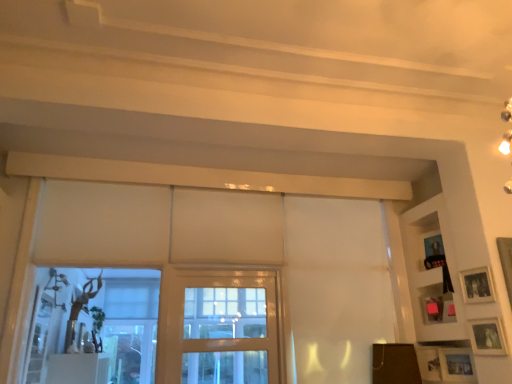
Image resolution: width=512 pixels, height=384 pixels. What do you see at coordinates (477, 285) in the screenshot? I see `matte black picture frame at upper right, acting as the fourth picture frame starting from the bottom` at bounding box center [477, 285].

What do you see at coordinates (431, 271) in the screenshot?
I see `wooden shelf at upper right` at bounding box center [431, 271].

What is the approximate width of matte silver picture frame at lower right, the 4th picture frame positioned from the top?

matte silver picture frame at lower right, the 4th picture frame positioned from the top, is 2.51 inches wide.

Measure the distance between point (488, 319) and camera.

A distance of 2.63 meters exists between point (488, 319) and camera.

What is the approximate width of matte white picture frame at lower right, the 2th picture frame positioned from the bottom?

1.22 inches.

What do you see at coordinates (336, 288) in the screenshot?
I see `white matte curtain at center` at bounding box center [336, 288].

In order to face brown matte board at lower right, should I rotate leftwards or rightwards?

Rotate your view right by about 18.520°.

Identify the location of matte black picture frame at upper right, acting as the first picture frame starting from the top. (477, 285).

Considering the relative sizes of pink matte picture frame at right, acting as the third picture frame starting from the bottom, and matte black picture frame at upper right, acting as the fourth picture frame starting from the bottom, in the image provided, is pink matte picture frame at right, acting as the third picture frame starting from the bottom, bigger than matte black picture frame at upper right, acting as the fourth picture frame starting from the bottom,?

Yes.

Is pink matte picture frame at right, acting as the third picture frame starting from the bottom, behind matte black picture frame at upper right, acting as the fourth picture frame starting from the bottom?

Yes, pink matte picture frame at right, acting as the third picture frame starting from the bottom, is further from the viewer.

Looking at their sizes, would you say pink matte picture frame at right, the 2th picture frame positioned from the top, is wider or thinner than matte black picture frame at upper right, acting as the first picture frame starting from the top?

pink matte picture frame at right, the 2th picture frame positioned from the top, is wider than matte black picture frame at upper right, acting as the first picture frame starting from the top.

Which point is more forward, (439,296) or (460,281)?

Point (460,281)

Could you tell me if white matte curtain at center is facing pink matte picture frame at right, acting as the third picture frame starting from the bottom?

Yes, white matte curtain at center is facing pink matte picture frame at right, acting as the third picture frame starting from the bottom.

Is white matte curtain at center wider than pink matte picture frame at right, the 2th picture frame positioned from the top?

Yes, white matte curtain at center is wider than pink matte picture frame at right, the 2th picture frame positioned from the top.

How different are the orientations of white matte curtain at center and pink matte picture frame at right, the 2th picture frame positioned from the top, in degrees?

61.5 degrees.

Between white matte curtain at center and pink matte picture frame at right, acting as the third picture frame starting from the bottom, which one is positioned behind?

pink matte picture frame at right, acting as the third picture frame starting from the bottom.

Do you think matte silver picture frame at lower right, the 1th picture frame in the bottom-to-top sequence, is within wooden shelf at upper right, or outside of it?

matte silver picture frame at lower right, the 1th picture frame in the bottom-to-top sequence, is not inside wooden shelf at upper right, it's outside.

Which object is further away from the camera taking this photo, matte silver picture frame at lower right, the 4th picture frame positioned from the top, or wooden shelf at upper right?

matte silver picture frame at lower right, the 4th picture frame positioned from the top.

Is matte silver picture frame at lower right, the 4th picture frame positioned from the top, smaller than wooden shelf at upper right?

Yes, matte silver picture frame at lower right, the 4th picture frame positioned from the top, is smaller than wooden shelf at upper right.

Image resolution: width=512 pixels, height=384 pixels. Identify the location of picture frame that is the 3rd object to the right of the wooden shelf at upper right, starting at the anchor. (456, 365).

Is brown matte board at lower right facing towards wooden shelf at upper right?

No, brown matte board at lower right does not turn towards wooden shelf at upper right.

Considering the relative positions of brown matte board at lower right and wooden shelf at upper right in the image provided, is brown matte board at lower right to the right of wooden shelf at upper right from the viewer's perspective?

Incorrect, brown matte board at lower right is not on the right side of wooden shelf at upper right.

Is point (414, 377) closer or farther from the camera than point (421, 251)?

Clearly, point (414, 377) is closer to the camera than point (421, 251).

Is brown matte board at lower right bigger or smaller than wooden shelf at upper right?

Clearly, brown matte board at lower right is smaller in size than wooden shelf at upper right.

Is clear glass screen door at center to the left of matte silver picture frame at lower right, the 4th picture frame positioned from the top, from the viewer's perspective?

Yes, clear glass screen door at center is to the left of matte silver picture frame at lower right, the 4th picture frame positioned from the top.

Is matte silver picture frame at lower right, the 1th picture frame in the bottom-to-top sequence, at the back of clear glass screen door at center?

No, clear glass screen door at center is not facing the opposite direction of matte silver picture frame at lower right, the 1th picture frame in the bottom-to-top sequence.

From the image's perspective, which one is positioned higher, clear glass screen door at center or matte silver picture frame at lower right, the 1th picture frame in the bottom-to-top sequence?

clear glass screen door at center is shown above in the image.

Can you tell me how much clear glass screen door at center and matte silver picture frame at lower right, the 1th picture frame in the bottom-to-top sequence, differ in facing direction?

They differ by 69 degrees in their facing directions.

Consider the image. What's the angular difference between brown matte board at lower right and pink matte picture frame at right, the 2th picture frame positioned from the top,'s facing directions?

They differ by 64 degrees in their facing directions.

Considering the sizes of brown matte board at lower right and pink matte picture frame at right, acting as the third picture frame starting from the bottom, in the image, is brown matte board at lower right taller or shorter than pink matte picture frame at right, acting as the third picture frame starting from the bottom,?

Clearly, brown matte board at lower right is taller compared to pink matte picture frame at right, acting as the third picture frame starting from the bottom.

From the brown matte board at lower right, count 1st picture frame to the right and point to it. Please provide its 2D coordinates.

[(433, 309)]

Is brown matte board at lower right not close to pink matte picture frame at right, the 2th picture frame positioned from the top?

Actually, brown matte board at lower right and pink matte picture frame at right, the 2th picture frame positioned from the top, are a little close together.

Can matte black picture frame at upper right, acting as the first picture frame starting from the top, be found inside matte white picture frame at lower right, the 2th picture frame positioned from the bottom?

No, matte black picture frame at upper right, acting as the first picture frame starting from the top, is not a part of matte white picture frame at lower right, the 2th picture frame positioned from the bottom.

Is matte white picture frame at lower right, the 3th picture frame when ordered from top to bottom, in front of matte black picture frame at upper right, acting as the fourth picture frame starting from the bottom?

Yes.

In terms of size, does matte white picture frame at lower right, the 3th picture frame when ordered from top to bottom, appear bigger or smaller than matte black picture frame at upper right, acting as the first picture frame starting from the top?

matte white picture frame at lower right, the 3th picture frame when ordered from top to bottom, is smaller than matte black picture frame at upper right, acting as the first picture frame starting from the top.

From the image's perspective, which picture frame is the 1st one below the matte black picture frame at upper right, acting as the fourth picture frame starting from the bottom? Please provide its 2D coordinates.

[(433, 309)]

Which picture frame is the 1st one when counting from the right side of the white matte curtain at center? Please provide its 2D coordinates.

[(433, 309)]

Estimate the real-world distances between objects in this image. Which object is closer to brown matte board at lower right, wooden shelf at upper right or clear glass screen door at center?

wooden shelf at upper right.

When comparing their distances from pink matte picture frame at right, acting as the third picture frame starting from the bottom, does wooden shelf at upper right or white matte curtain at center seem further?

The object further to pink matte picture frame at right, acting as the third picture frame starting from the bottom, is white matte curtain at center.

Which object lies nearer to the anchor point clear glass screen door at center, pink matte picture frame at right, acting as the third picture frame starting from the bottom, or matte black picture frame at upper right, acting as the fourth picture frame starting from the bottom?

The object closer to clear glass screen door at center is pink matte picture frame at right, acting as the third picture frame starting from the bottom.

Estimate the real-world distances between objects in this image. Which object is further from matte black picture frame at upper right, acting as the fourth picture frame starting from the bottom, wooden shelf at upper right or pink matte picture frame at right, acting as the third picture frame starting from the bottom?

pink matte picture frame at right, acting as the third picture frame starting from the bottom, is further to matte black picture frame at upper right, acting as the fourth picture frame starting from the bottom.

Which object lies nearer to the anchor point white matte curtain at center, wooden shelf at upper right or matte white picture frame at lower right, the 2th picture frame positioned from the bottom?

The object closer to white matte curtain at center is wooden shelf at upper right.

Which object lies nearer to the anchor point matte black picture frame at upper right, acting as the first picture frame starting from the top, clear glass screen door at center or white matte curtain at center?

Among the two, white matte curtain at center is located nearer to matte black picture frame at upper right, acting as the first picture frame starting from the top.

Which object lies nearer to the anchor point matte black picture frame at upper right, acting as the fourth picture frame starting from the bottom, pink matte picture frame at right, acting as the third picture frame starting from the bottom, or wooden shelf at upper right?

Based on the image, wooden shelf at upper right appears to be nearer to matte black picture frame at upper right, acting as the fourth picture frame starting from the bottom.

When comparing their distances from white matte curtain at center, does wooden shelf at upper right or brown matte board at lower right seem further?

Based on the image, wooden shelf at upper right appears to be further to white matte curtain at center.

Identify the location of shelf positioned between matte black picture frame at upper right, acting as the fourth picture frame starting from the bottom, and pink matte picture frame at right, acting as the third picture frame starting from the bottom, from near to far. (431, 271).

In order to click on curtain between clear glass screen door at center and wooden shelf at upper right from left to right in this screenshot , I will do `click(336, 288)`.

This screenshot has width=512, height=384. In order to click on curtain located between clear glass screen door at center and pink matte picture frame at right, acting as the third picture frame starting from the bottom, in the left-right direction in this screenshot , I will do `click(336, 288)`.

Identify the location of shelf between matte black picture frame at upper right, acting as the first picture frame starting from the top, and matte white picture frame at lower right, the 2th picture frame positioned from the bottom, from top to bottom. This screenshot has height=384, width=512. (431, 271).